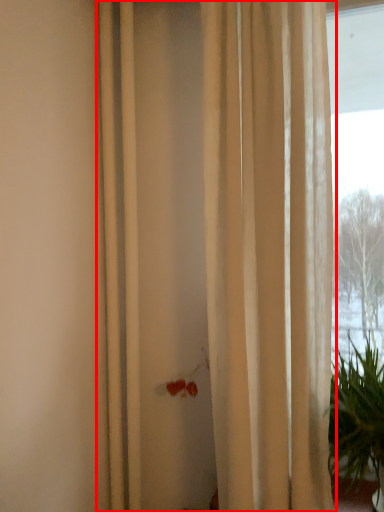
Question: From the image's perspective, where is curtain (annotated by the red box) located relative to houseplant?

Choices:
 (A) above
 (B) below

Answer: (A)